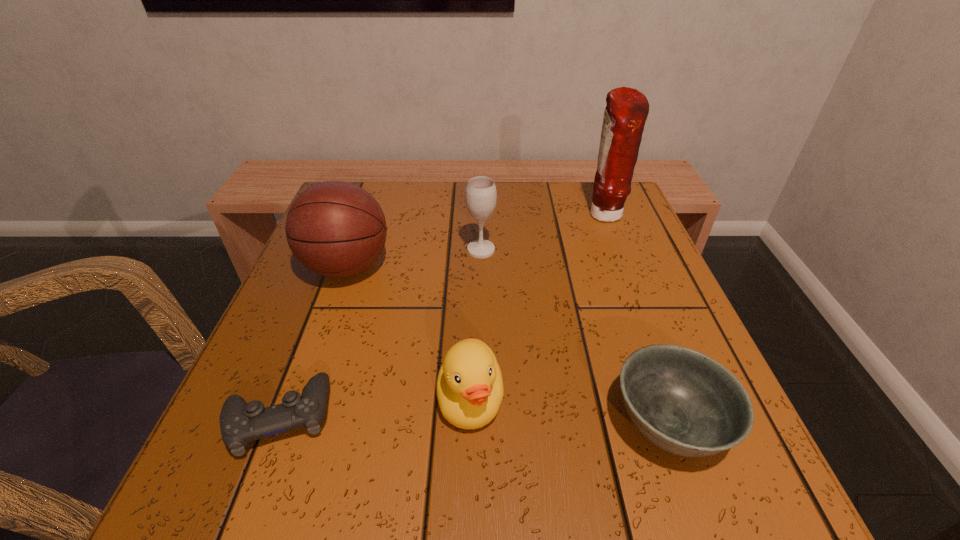
Where is `free region located 0.060m at the beak of the fourth tallest object`? The height and width of the screenshot is (540, 960). free region located 0.060m at the beak of the fourth tallest object is located at coordinates (468, 486).

Where is `vacant space located on the left of the fifth tallest object`? The height and width of the screenshot is (540, 960). vacant space located on the left of the fifth tallest object is located at coordinates (542, 423).

Locate an element on the screen. This screenshot has height=540, width=960. free region located 0.140m on the back of the shortest object is located at coordinates (318, 315).

Find the location of `object that is positioned at the far edge`. object that is positioned at the far edge is located at coordinates (627, 109).

Where is `bowl that is at the near edge`? The image size is (960, 540). bowl that is at the near edge is located at coordinates (686, 403).

Where is `control that is positioned at the near edge`? control that is positioned at the near edge is located at coordinates (240, 423).

Identify the location of basketball that is at the left edge. (336, 229).

You are a GUI agent. You are given a task and a screenshot of the screen. Output one action in this format:
    pyautogui.click(x=<x>, y=<y>)
    Task: Click on the control located in the left edge section of the desktop
    The width and height of the screenshot is (960, 540).
    Given the screenshot: What is the action you would take?
    pyautogui.click(x=240, y=423)

This screenshot has width=960, height=540. I want to click on condiment located at the right edge, so click(x=627, y=109).

Identify the location of bowl located in the right edge section of the desktop. (686, 403).